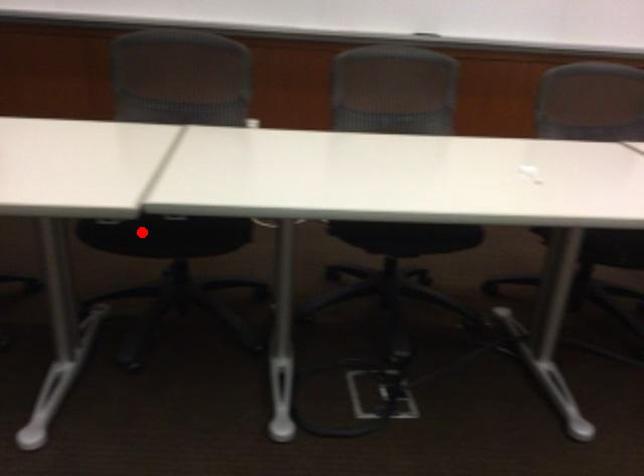
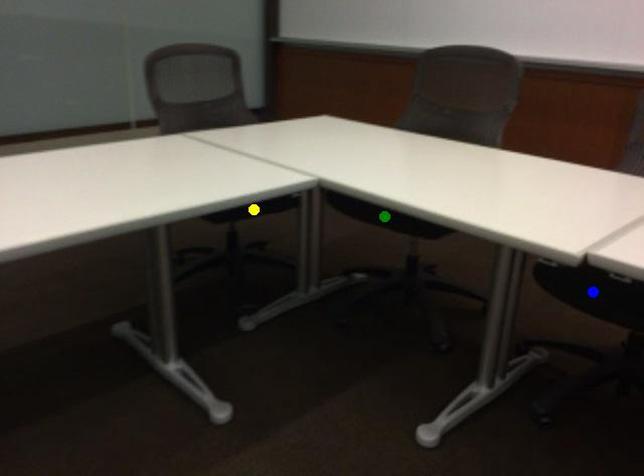
Question: I am providing you with two images of the same scene from different viewpoints. A red point is marked on the first image. You are given multiple points on the second image. In image 2, which mark is for the same physical point as the one in image 1?

Choices:
 (A) green point
 (B) blue point
 (C) yellow point

Answer: (B)